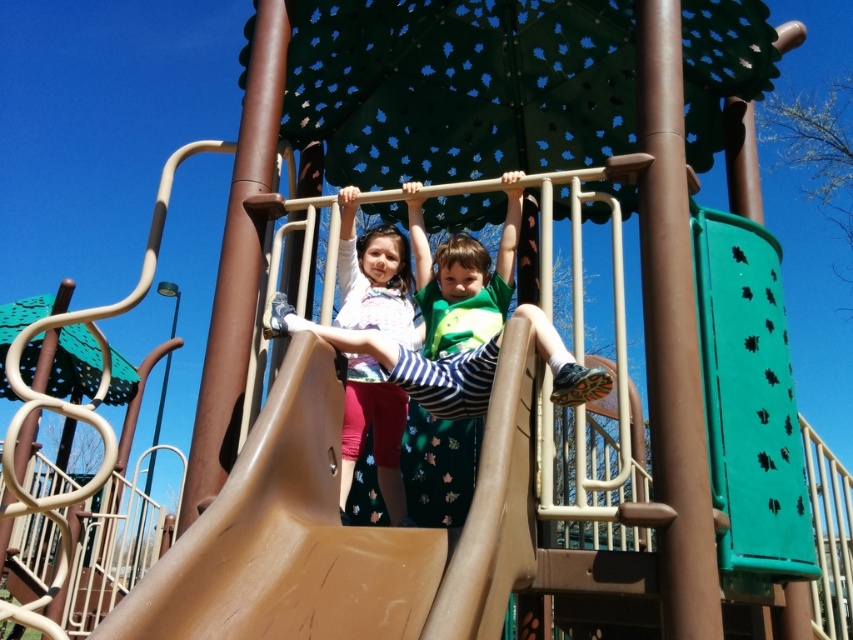
Question: Does brown matte slide at center appear over matte striped shirt at center?

Choices:
 (A) no
 (B) yes

Answer: (A)

Question: Which of the following is the farthest from the observer?

Choices:
 (A) [x=519, y=316]
 (B) [x=393, y=420]
 (C) [x=223, y=600]

Answer: (B)

Question: Where is matte striped shirt at center located in relation to matte white shirt at center in the image?

Choices:
 (A) right
 (B) left

Answer: (A)

Question: Which point is closer to the camera?

Choices:
 (A) (312, 458)
 (B) (363, 310)

Answer: (A)

Question: Considering the relative positions of brown matte slide at center and matte striped shirt at center in the image provided, where is brown matte slide at center located with respect to matte striped shirt at center?

Choices:
 (A) left
 (B) right

Answer: (A)

Question: Among these points, which one is nearest to the camera?

Choices:
 (A) (503, 461)
 (B) (376, 442)
 (C) (608, 372)

Answer: (A)